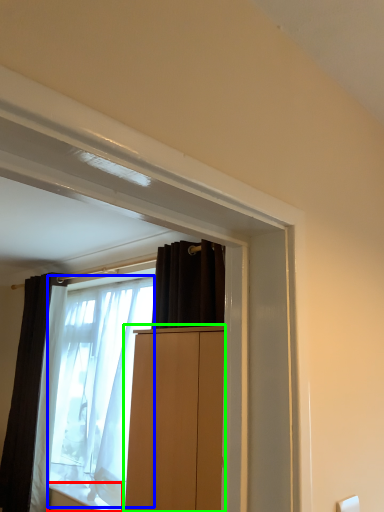
Question: Considering the real-world distances, which object is closest to window sill (highlighted by a red box)? shower curtain (highlighted by a blue box) or cabinetry (highlighted by a green box).

Choices:
 (A) shower curtain
 (B) cabinetry

Answer: (A)